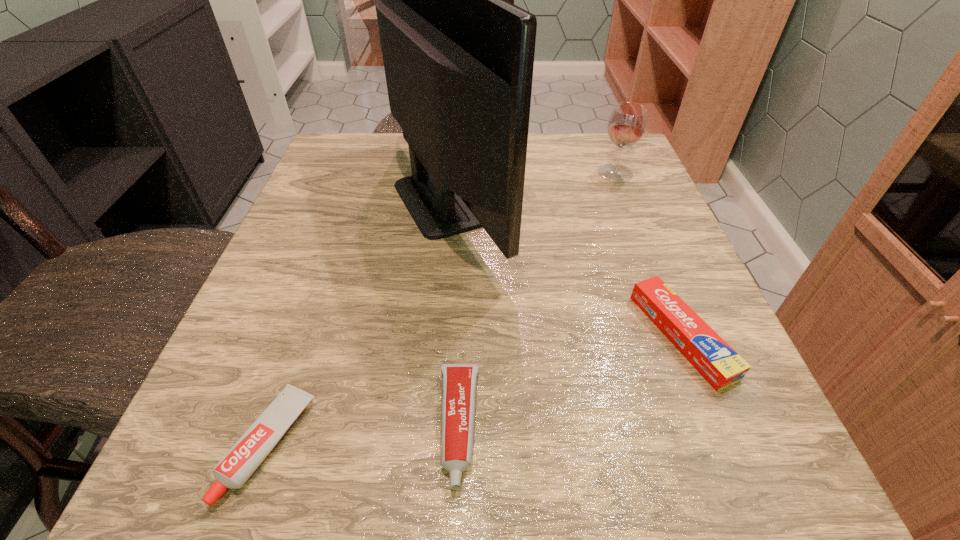
Find the location of a particular element. the tallest object is located at coordinates click(458, 57).

You are a GUI agent. You are given a task and a screenshot of the screen. Output one action in this format:
    pyautogui.click(x=<x>, y=<y>)
    Task: Click on the second tallest object
    The height and width of the screenshot is (540, 960).
    Given the screenshot: What is the action you would take?
    pyautogui.click(x=627, y=123)

At what (x,y) coordinates should I click in order to perform the action: click on the rightmost toothpaste. Please return your answer as a coordinate pair (x, y). The image size is (960, 540). Looking at the image, I should click on (720, 365).

I want to click on the second toothpaste from right to left, so click(458, 393).

Where is `the leftmost toothpaste`? the leftmost toothpaste is located at coordinates (235, 468).

Where is `vacant space situated 0.060m on the front-facing side of the computer monitor`? The width and height of the screenshot is (960, 540). vacant space situated 0.060m on the front-facing side of the computer monitor is located at coordinates (540, 200).

I want to click on vacant space located 0.250m on the front of the fourth shortest object, so click(x=652, y=264).

Find the location of a particular element. vacant space located on the left of the rightmost toothpaste is located at coordinates (471, 336).

Find the location of `free region located on the back of the leftmost object`. free region located on the back of the leftmost object is located at coordinates (350, 209).

Identify the location of computer monitor present at the far edge. The width and height of the screenshot is (960, 540). (458, 57).